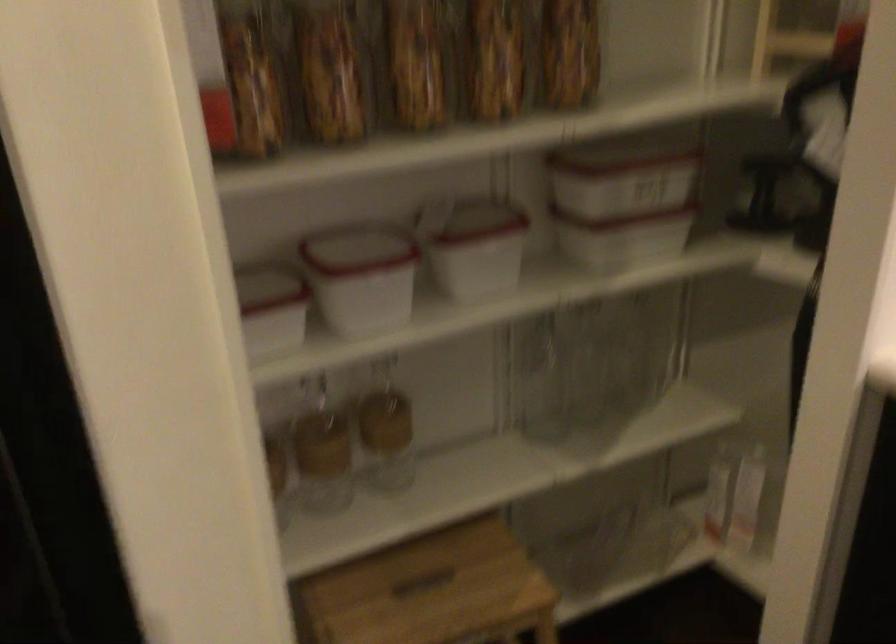
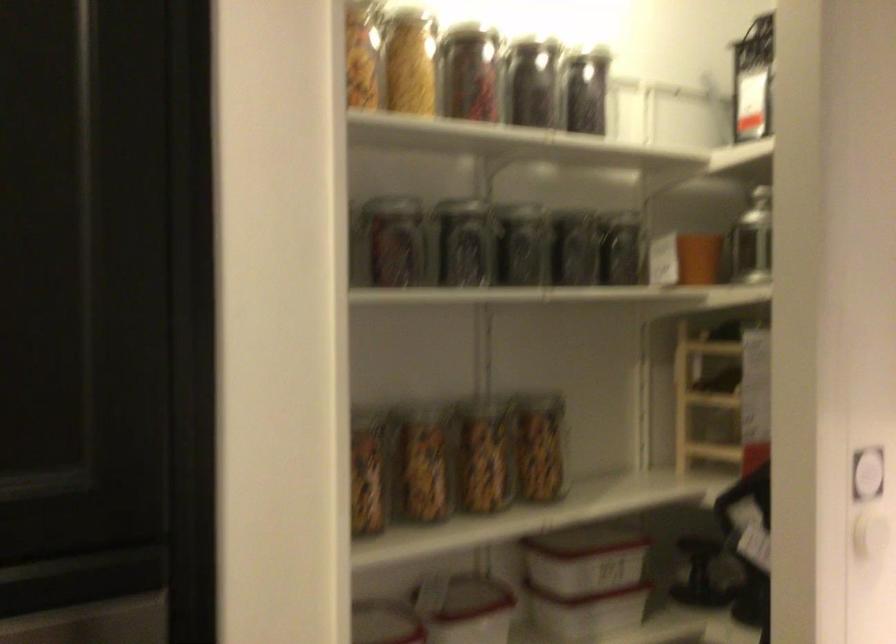
The point at [762,199] is marked in the first image. Where is the corresponding point in the second image?

(700, 574)